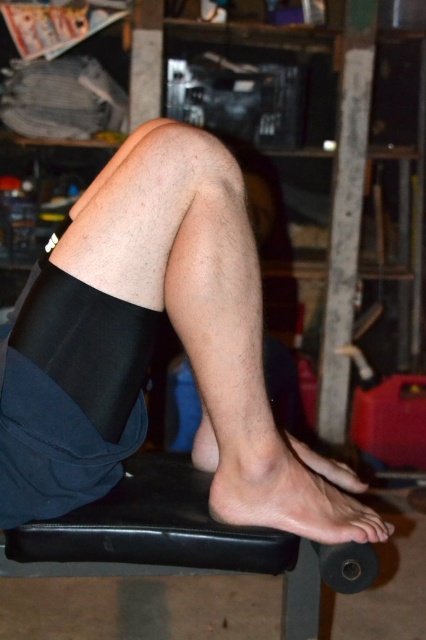
You are a physical therapist observing a patient in the image. The patient has two objects in focus, the hairless skin at center and the skinny barefoot at lower center. Which object is bigger in size?

The hairless skin at center has a larger size compared to the skinny barefoot at lower center.

You are a physical therapist observing a patient during a rehabilitation session. You notice a point marked at coordinates (247, 384) on the image. Based on the scene, where is this point located on the patient?

The point at coordinates (247, 384) is located on hairless skin at center.

You are a physical therapist helping a patient who needs to place their knee brace on the bench. The patient is looking at the black matte knee brace at center and the black rubber stool at lower center. Which object should the patient place their brace on to ensure it is properly positioned?

The black matte knee brace at center should be placed on the black rubber stool at lower center since it is positioned over the stool according to the description.